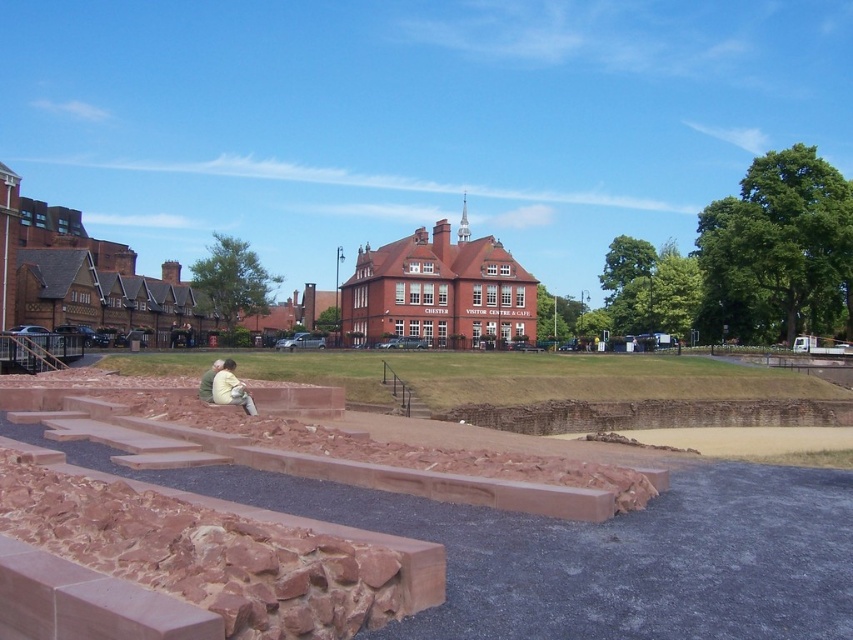
Does brown stone park at center have a larger size compared to green fabric jacket at lower left?

Correct, brown stone park at center is larger in size than green fabric jacket at lower left.

Is brown stone park at center to the right of green fabric jacket at lower left from the viewer's perspective?

Yes, brown stone park at center is to the right of green fabric jacket at lower left.

Where is `brown stone park at center`? This screenshot has height=640, width=853. brown stone park at center is located at coordinates (593, 552).

Does brown stone park at center have a lesser width compared to light beige fabric at center?

Incorrect, brown stone park at center's width is not less than light beige fabric at center's.

This screenshot has height=640, width=853. What do you see at coordinates (593, 552) in the screenshot?
I see `brown stone park at center` at bounding box center [593, 552].

Does point (712, 550) lie behind point (230, 372)?

No, (712, 550) is closer to viewer.

I want to click on brown stone park at center, so click(593, 552).

Who is positioned more to the right, light beige fabric at center or green fabric jacket at lower left?

Positioned to the right is light beige fabric at center.

Does point (221, 372) come closer to viewer compared to point (212, 400)?

No, it is behind (212, 400).

The width and height of the screenshot is (853, 640). Describe the element at coordinates (230, 388) in the screenshot. I see `light beige fabric at center` at that location.

The width and height of the screenshot is (853, 640). I want to click on light beige fabric at center, so click(x=230, y=388).